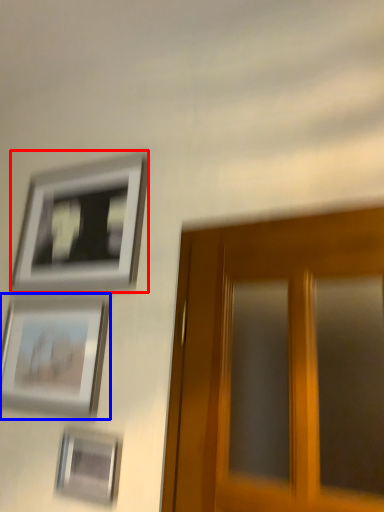
Question: Which of the following is the closest to the observer, picture frame (highlighted by a red box) or picture frame (highlighted by a blue box)?

Choices:
 (A) picture frame
 (B) picture frame

Answer: (B)